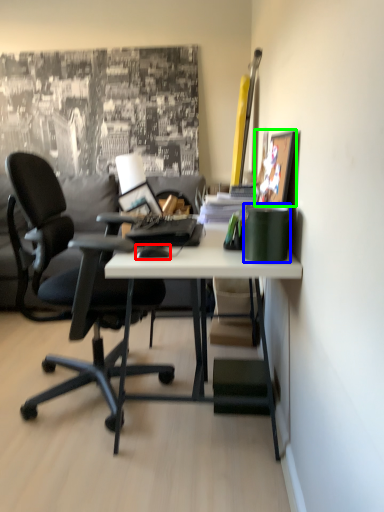
Question: Which is nearer to the mouse (highlighted by a red box)? stationery (highlighted by a blue box) or picture frame (highlighted by a green box).

Choices:
 (A) stationery
 (B) picture frame

Answer: (A)